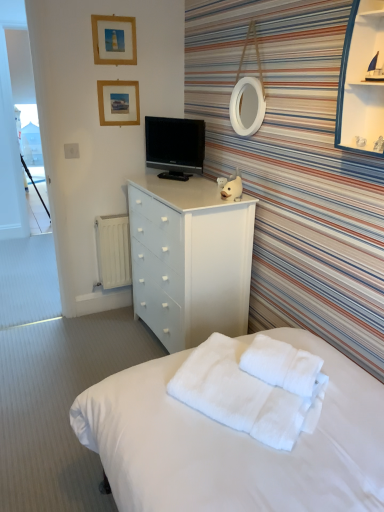
I want to click on free space above white fluffy blanket at lower center (from a real-world perspective), so click(246, 367).